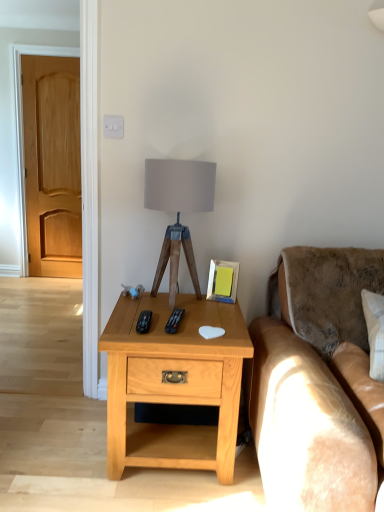
Question: Is metallic silver picture frame at upper right surrounding light wood/texturedesk at center?

Choices:
 (A) no
 (B) yes

Answer: (A)

Question: Are metallic silver picture frame at upper right and light wood/texturedesk at center far apart?

Choices:
 (A) no
 (B) yes

Answer: (A)

Question: From the image's perspective, is metallic silver picture frame at upper right located above light wood/texturedesk at center?

Choices:
 (A) no
 (B) yes

Answer: (B)

Question: From a real-world perspective, is metallic silver picture frame at upper right beneath light wood/texturedesk at center?

Choices:
 (A) no
 (B) yes

Answer: (A)

Question: Does metallic silver picture frame at upper right have a greater height compared to light wood/texturedesk at center?

Choices:
 (A) yes
 (B) no

Answer: (B)

Question: Is metallic silver picture frame at upper right closer to camera compared to light wood/texturedesk at center?

Choices:
 (A) no
 (B) yes

Answer: (A)

Question: From the image's perspective, is black plastic remote at center, the 2th remote when ordered from left to right, located beneath matte gray fabric at center?

Choices:
 (A) no
 (B) yes

Answer: (B)

Question: Can you confirm if black plastic remote at center, the 2th remote when ordered from left to right, is thinner than matte gray fabric at center?

Choices:
 (A) yes
 (B) no

Answer: (A)

Question: Can you confirm if black plastic remote at center, the 2th remote when ordered from left to right, is wider than matte gray fabric at center?

Choices:
 (A) yes
 (B) no

Answer: (B)

Question: Is black plastic remote at center, the 2th remote when ordered from left to right, bigger than matte gray fabric at center?

Choices:
 (A) yes
 (B) no

Answer: (B)

Question: Does black plastic remote at center, the 1th remote positioned from the right, have a greater height compared to matte gray fabric at center?

Choices:
 (A) no
 (B) yes

Answer: (A)

Question: Does black plastic remote at center, the 2th remote when ordered from left to right, come in front of matte gray fabric at center?

Choices:
 (A) yes
 (B) no

Answer: (A)

Question: From a real-world perspective, is black plastic remote at center, the 2th remote when ordered from left to right, over light wood/texturedesk at center?

Choices:
 (A) yes
 (B) no

Answer: (A)